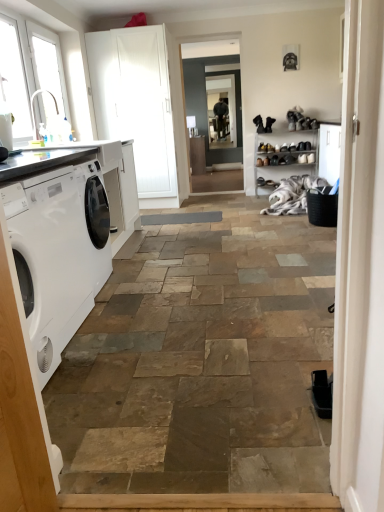
Question: From a real-world perspective, is white fluffy laundry at center positioned over white plastic window at upper left, placed as the 1th window when sorted from front to back, based on gravity?

Choices:
 (A) no
 (B) yes

Answer: (A)

Question: Does white fluffy laundry at center have a greater height compared to white plastic window at upper left, which is the second window from back to front?

Choices:
 (A) no
 (B) yes

Answer: (A)

Question: Is white fluffy laundry at center turned away from white plastic window at upper left, which is the second window from back to front?

Choices:
 (A) yes
 (B) no

Answer: (B)

Question: Is white fluffy laundry at center to the left of white plastic window at upper left, placed as the 1th window when sorted from front to back, from the viewer's perspective?

Choices:
 (A) no
 (B) yes

Answer: (A)

Question: Can you confirm if white fluffy laundry at center is positioned to the right of white plastic window at upper left, placed as the 1th window when sorted from front to back?

Choices:
 (A) no
 (B) yes

Answer: (B)

Question: Is white fluffy laundry at center bigger than white plastic window at upper left, placed as the 1th window when sorted from front to back?

Choices:
 (A) yes
 (B) no

Answer: (A)

Question: From the image's perspective, is white glass window at upper left, which appears as the first window when viewed from the back, located beneath white plastic window at upper left, placed as the 1th window when sorted from front to back?

Choices:
 (A) no
 (B) yes

Answer: (A)

Question: Can you confirm if white glass window at upper left, which is counted as the 2th window, starting from the front, is positioned to the right of white plastic window at upper left, placed as the 1th window when sorted from front to back?

Choices:
 (A) no
 (B) yes

Answer: (B)

Question: From the image's perspective, is white glass window at upper left, which is counted as the 2th window, starting from the front, over white plastic window at upper left, placed as the 1th window when sorted from front to back?

Choices:
 (A) no
 (B) yes

Answer: (B)

Question: Is the surface of white glass window at upper left, which appears as the first window when viewed from the back, in direct contact with white plastic window at upper left, which is the second window from back to front?

Choices:
 (A) yes
 (B) no

Answer: (B)

Question: Considering the relative sizes of white glass window at upper left, which is counted as the 2th window, starting from the front, and white plastic window at upper left, which is the second window from back to front, in the image provided, is white glass window at upper left, which is counted as the 2th window, starting from the front, shorter than white plastic window at upper left, which is the second window from back to front,?

Choices:
 (A) yes
 (B) no

Answer: (B)

Question: Can you confirm if white glass window at upper left, which appears as the first window when viewed from the back, is wider than white plastic window at upper left, placed as the 1th window when sorted from front to back?

Choices:
 (A) yes
 (B) no

Answer: (B)

Question: Considering the relative positions of white glass window at upper left, which is counted as the 2th window, starting from the front, and white matte screen door at upper left, the 2th screen door from the right, in the image provided, is white glass window at upper left, which is counted as the 2th window, starting from the front, to the right of white matte screen door at upper left, the 2th screen door from the right, from the viewer's perspective?

Choices:
 (A) yes
 (B) no

Answer: (B)